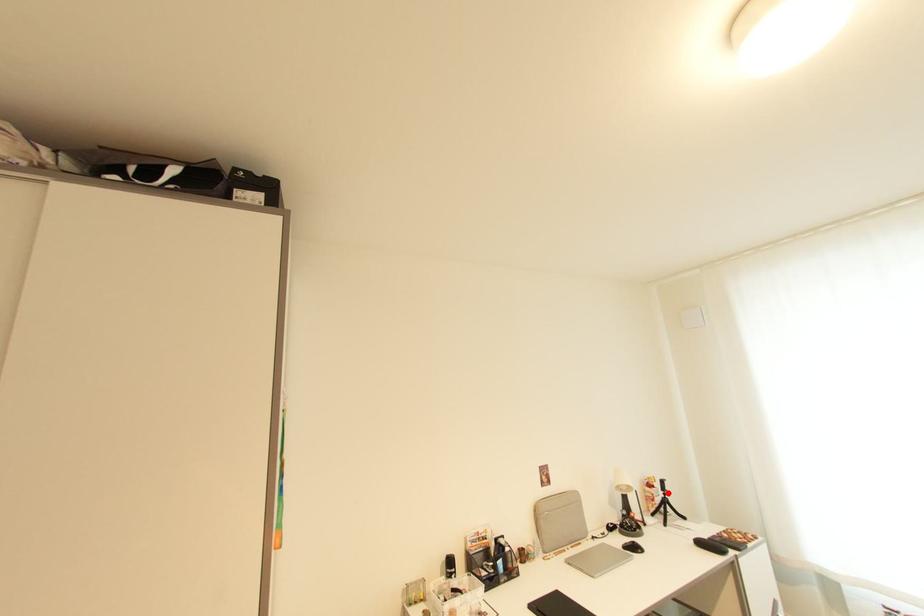
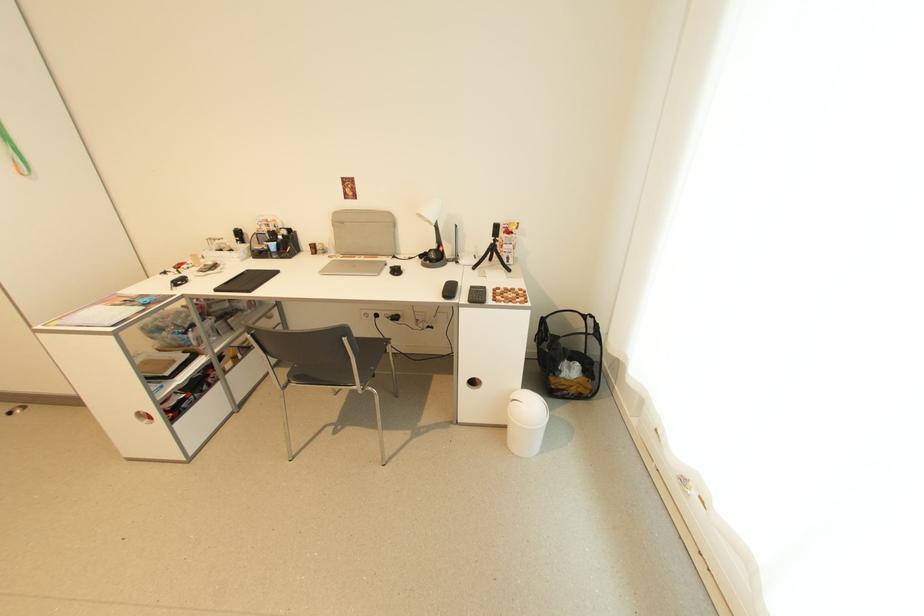
Question: I am providing you with two images of the same scene from different viewpoints. A red point is marked on the first image. Can you still see the location of the red point in image 2?

Choices:
 (A) Yes
 (B) No

Answer: (A)